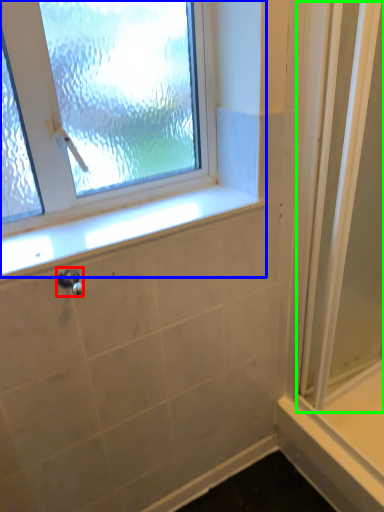
Question: Which is farther away from shower (highlighted by a red box)? window (highlighted by a blue box) or screen door (highlighted by a green box)?

Choices:
 (A) window
 (B) screen door

Answer: (B)